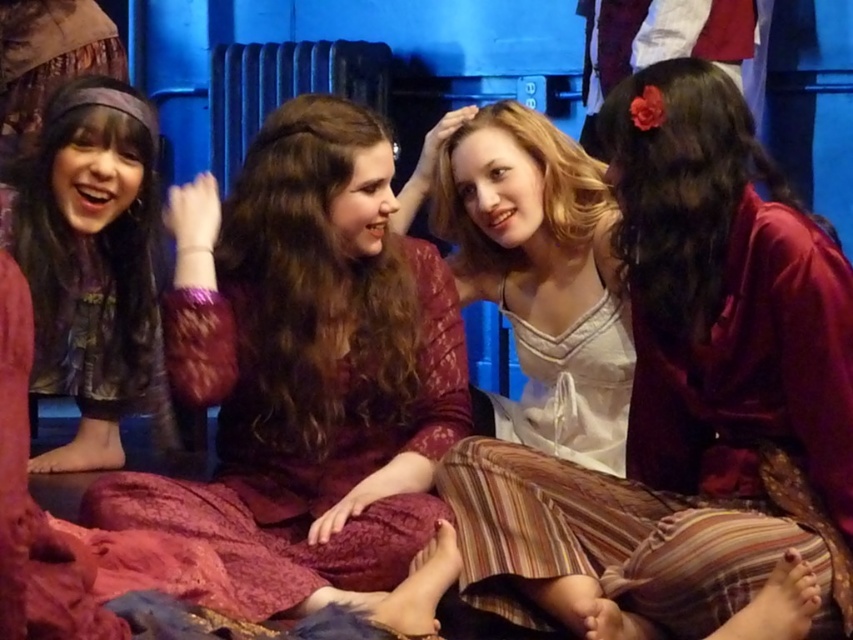
Question: Does matte burgundy dress at center come in front of matte purple dress at left?

Choices:
 (A) no
 (B) yes

Answer: (B)

Question: Can you confirm if white satin dress at center is wider than metallic radiator at center?

Choices:
 (A) yes
 (B) no

Answer: (B)

Question: Which of these objects is positioned closest to the white satin dress at center?

Choices:
 (A) metallic radiator at center
 (B) matte burgundy dress at center

Answer: (B)

Question: Estimate the real-world distances between objects in this image. Which object is closer to the matte purple dress at left?

Choices:
 (A) metallic radiator at center
 (B) matte white blouse at center
 (C) white satin dress at center
 (D) matte burgundy dress at center

Answer: (D)

Question: Which point is farther to the camera?

Choices:
 (A) matte white blouse at center
 (B) matte burgundy dress at center
 (C) matte purple dress at left
 (D) metallic radiator at center

Answer: (D)

Question: Considering the relative positions of white satin dress at center and metallic radiator at center in the image provided, where is white satin dress at center located with respect to metallic radiator at center?

Choices:
 (A) above
 (B) below

Answer: (B)